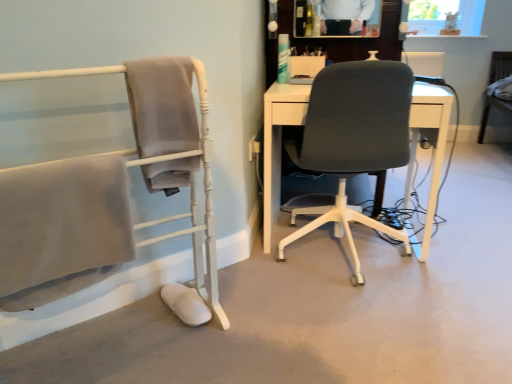
How much space does dark gray fabric office chair at center, arranged as the 2th chair when viewed from the left, occupy vertically?

dark gray fabric office chair at center, arranged as the 2th chair when viewed from the left, is 34.95 inches tall.

Where is `matte gray chair at left, which is the first chair in left-to-right order`? The width and height of the screenshot is (512, 384). matte gray chair at left, which is the first chair in left-to-right order is located at coordinates (108, 193).

Locate an element on the screen. dark gray fabric office chair at center, arranged as the 2th chair when viewed from the left is located at coordinates (354, 140).

In the image, is wooden chair at right, the third chair when ordered from front to back, positioned in front of or behind matte gray chair at left, the first chair viewed from the front?

Clearly, wooden chair at right, the third chair when ordered from front to back, is behind matte gray chair at left, the first chair viewed from the front.

In terms of size, does wooden chair at right, the first chair viewed from the back, appear bigger or smaller than matte gray chair at left, which appears as the third chair when viewed from the right?

wooden chair at right, the first chair viewed from the back, is bigger than matte gray chair at left, which appears as the third chair when viewed from the right.

From the image's perspective, is wooden chair at right, the third chair when ordered from front to back, above or below matte gray chair at left, which appears as the third chair when viewed from the right?

wooden chair at right, the third chair when ordered from front to back, is above matte gray chair at left, which appears as the third chair when viewed from the right.

Which object is further away from the camera, matte gray chair at left, positioned as the third chair in back-to-front order, or wooden chair at right, placed as the 1th chair when sorted from right to left?

wooden chair at right, placed as the 1th chair when sorted from right to left, is more distant.

From a real-world perspective, relative to wooden chair at right, the third chair when ordered from front to back, is matte gray chair at left, the first chair viewed from the front, vertically above or below?

Clearly, from a real-world perspective, matte gray chair at left, the first chair viewed from the front, is above wooden chair at right, the third chair when ordered from front to back.

Who is bigger, matte gray chair at left, which appears as the third chair when viewed from the right, or wooden chair at right, the third chair when ordered from front to back?

Bigger between the two is wooden chair at right, the third chair when ordered from front to back.

Is matte gray chair at left, which is the first chair in left-to-right order, wider or thinner than wooden chair at right, the first chair viewed from the back?

matte gray chair at left, which is the first chair in left-to-right order, is thinner than wooden chair at right, the first chair viewed from the back.

Between dark gray fabric office chair at center, which is the second chair in back-to-front order, and wooden chair at right, placed as the 1th chair when sorted from right to left, which one has larger width?

Wider between the two is dark gray fabric office chair at center, which is the second chair in back-to-front order.

From their relative heights in the image, would you say dark gray fabric office chair at center, the second chair positioned from the right, is taller or shorter than wooden chair at right, the third chair when ordered from front to back?

Clearly, dark gray fabric office chair at center, the second chair positioned from the right, is taller compared to wooden chair at right, the third chair when ordered from front to back.

Looking at this image, which is less distant, (320, 103) or (494, 56)?

Clearly, point (320, 103) is closer to the camera than point (494, 56).

From the image's perspective, does dark gray fabric office chair at center, arranged as the 2th chair when viewed from the left, appear lower than wooden chair at right, the third chair when ordered from front to back?

Indeed, from the image's perspective, dark gray fabric office chair at center, arranged as the 2th chair when viewed from the left, is shown beneath wooden chair at right, the third chair when ordered from front to back.

I want to click on chair above the dark gray fabric office chair at center, the second chair positioned from the right (from a real-world perspective), so click(x=108, y=193).

Is point (42, 188) closer or farther from the camera than point (313, 101)?

Point (42, 188).

Can you confirm if matte gray chair at left, which is the first chair in left-to-right order, is thinner than dark gray fabric office chair at center, the second chair positioned from the right?

Correct, the width of matte gray chair at left, which is the first chair in left-to-right order, is less than that of dark gray fabric office chair at center, the second chair positioned from the right.

Which of these two, matte gray chair at left, the first chair viewed from the front, or dark gray fabric office chair at center, the second chair positioned from the right, stands taller?

Standing taller between the two is matte gray chair at left, the first chair viewed from the front.

Where is `chair in front of the dark gray fabric office chair at center, the second chair positioned from the right`? The height and width of the screenshot is (384, 512). chair in front of the dark gray fabric office chair at center, the second chair positioned from the right is located at coordinates (108, 193).

Is dark gray fabric office chair at center, which is the second chair in back-to-front order, bigger than matte gray chair at left, which appears as the third chair when viewed from the right?

Indeed, dark gray fabric office chair at center, which is the second chair in back-to-front order, has a larger size compared to matte gray chair at left, which appears as the third chair when viewed from the right.

Is dark gray fabric office chair at center, which is the second chair in front-to-back order, completely or partially outside of matte gray chair at left, the first chair viewed from the front?

Yes, dark gray fabric office chair at center, which is the second chair in front-to-back order, is outside of matte gray chair at left, the first chair viewed from the front.

Is dark gray fabric office chair at center, arranged as the 2th chair when viewed from the left, oriented towards matte gray chair at left, which appears as the third chair when viewed from the right?

No, dark gray fabric office chair at center, arranged as the 2th chair when viewed from the left, is not turned towards matte gray chair at left, which appears as the third chair when viewed from the right.

Could you measure the distance between wooden chair at right, the first chair viewed from the back, and dark gray fabric office chair at center, which is the second chair in back-to-front order?

A distance of 7.64 feet exists between wooden chair at right, the first chair viewed from the back, and dark gray fabric office chair at center, which is the second chair in back-to-front order.

From the image's perspective, which is above, wooden chair at right, the third chair when ordered from front to back, or dark gray fabric office chair at center, the second chair positioned from the right?

wooden chair at right, the third chair when ordered from front to back.

Is wooden chair at right, marked as the third chair in a left-to-right arrangement, inside the boundaries of dark gray fabric office chair at center, the second chair positioned from the right, or outside?

wooden chair at right, marked as the third chair in a left-to-right arrangement, is not enclosed by dark gray fabric office chair at center, the second chair positioned from the right.

Does wooden chair at right, the first chair viewed from the back, appear on the left side of dark gray fabric office chair at center, which is the second chair in front-to-back order?

Incorrect, wooden chair at right, the first chair viewed from the back, is not on the left side of dark gray fabric office chair at center, which is the second chair in front-to-back order.

The width and height of the screenshot is (512, 384). I want to click on the 2nd chair in front when counting from the wooden chair at right, marked as the third chair in a left-to-right arrangement, so click(108, 193).

At what (x,y) coordinates should I click in order to perform the action: click on chair that is the 2nd object located above the matte gray chair at left, the first chair viewed from the front (from the image's perspective). Please return your answer as a coordinate pair (x, y). Image resolution: width=512 pixels, height=384 pixels. Looking at the image, I should click on (500, 66).

When comparing their distances from dark gray fabric office chair at center, the second chair positioned from the right, does matte gray chair at left, which is the first chair in left-to-right order, or wooden chair at right, the first chair viewed from the back, seem further?

Among the two, wooden chair at right, the first chair viewed from the back, is located further to dark gray fabric office chair at center, the second chair positioned from the right.

Considering their positions, is wooden chair at right, placed as the 1th chair when sorted from right to left, positioned closer to dark gray fabric office chair at center, arranged as the 2th chair when viewed from the left, than matte gray chair at left, the first chair viewed from the front?

Based on the image, matte gray chair at left, the first chair viewed from the front, appears to be nearer to dark gray fabric office chair at center, arranged as the 2th chair when viewed from the left.

From the picture: Looking at the image, which one is located further to wooden chair at right, placed as the 1th chair when sorted from right to left, dark gray fabric office chair at center, which is the second chair in back-to-front order, or matte gray chair at left, positioned as the third chair in back-to-front order?

matte gray chair at left, positioned as the third chair in back-to-front order, is further to wooden chair at right, placed as the 1th chair when sorted from right to left.

From the image, which object appears to be farther from wooden chair at right, marked as the third chair in a left-to-right arrangement, matte gray chair at left, the first chair viewed from the front, or dark gray fabric office chair at center, which is the second chair in back-to-front order?

Among the two, matte gray chair at left, the first chair viewed from the front, is located further to wooden chair at right, marked as the third chair in a left-to-right arrangement.

Considering their positions, is wooden chair at right, marked as the third chair in a left-to-right arrangement, positioned closer to matte gray chair at left, positioned as the third chair in back-to-front order, than dark gray fabric office chair at center, which is the second chair in front-to-back order?

dark gray fabric office chair at center, which is the second chair in front-to-back order, is closer to matte gray chair at left, positioned as the third chair in back-to-front order.

From the image, which object appears to be farther from matte gray chair at left, the first chair viewed from the front, dark gray fabric office chair at center, arranged as the 2th chair when viewed from the left, or wooden chair at right, marked as the third chair in a left-to-right arrangement?

wooden chair at right, marked as the third chair in a left-to-right arrangement, is further to matte gray chair at left, the first chair viewed from the front.

The width and height of the screenshot is (512, 384). In order to click on chair between matte gray chair at left, which appears as the third chair when viewed from the right, and wooden chair at right, marked as the third chair in a left-to-right arrangement, in the horizontal direction in this screenshot , I will do `click(354, 140)`.